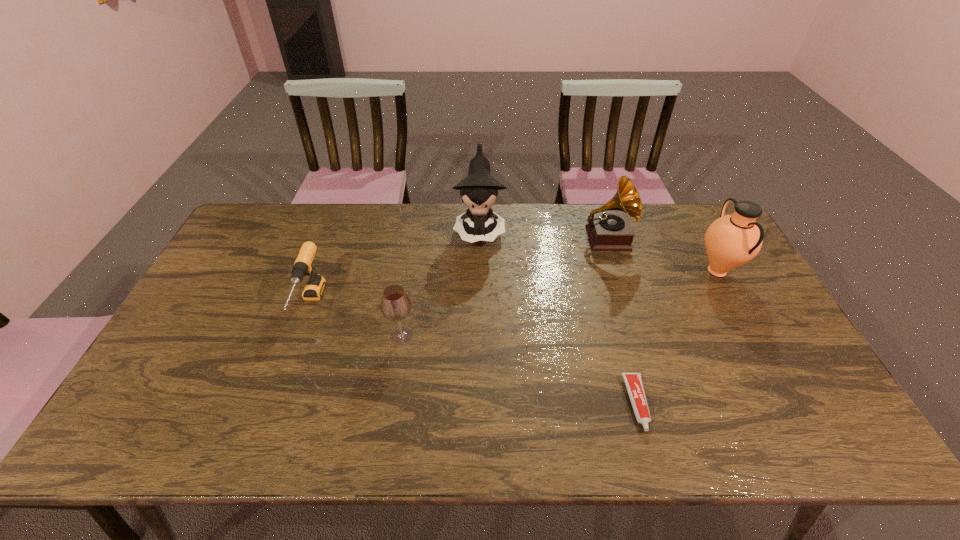
Image resolution: width=960 pixels, height=540 pixels. Find the location of `free point between the toothpaste and the phonograph record`. free point between the toothpaste and the phonograph record is located at coordinates (622, 321).

The image size is (960, 540). Find the location of `free spot between the phonograph record and the rightmost object`. free spot between the phonograph record and the rightmost object is located at coordinates (661, 254).

The image size is (960, 540). In order to click on free space between the second object from left to right and the fifth tallest object in this screenshot , I will do `click(356, 320)`.

This screenshot has height=540, width=960. In order to click on object identified as the fifth closest to the wineglass in this screenshot , I will do 732,240.

Identify which object is located as the nearest to the doll. Please provide its 2D coordinates. Your answer should be formatted as a tuple, i.e. [(x, y)], where the tuple contains the x and y coordinates of a point satisfying the conditions above.

[(606, 230)]

Image resolution: width=960 pixels, height=540 pixels. Identify the location of blank space that satisfies the following two spatial constraints: 1. on the handle side of the leftmost object; 2. on the right side of the second object from left to right. (300, 336).